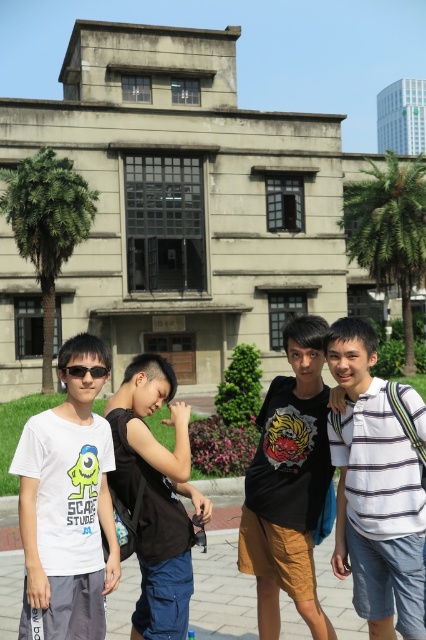
Question: Does gray concrete pavement at lower center appear on the right side of black plastic sunglasses at center?

Choices:
 (A) yes
 (B) no

Answer: (A)

Question: Does white matte t-shirt at left lie in front of gray concrete pavement at lower center?

Choices:
 (A) no
 (B) yes

Answer: (B)

Question: Which object appears closest to the camera in this image?

Choices:
 (A) black matte t-shirt at center
 (B) black cotton tank top at center
 (C) white matte t-shirt at left

Answer: (C)

Question: Does white matte t-shirt at left have a lesser width compared to gray concrete pavement at lower center?

Choices:
 (A) no
 (B) yes

Answer: (B)

Question: Which point appears farthest from the camera in this image?

Choices:
 (A) (100, 368)
 (B) (321, 602)
 (C) (242, 563)
 (D) (141, 570)

Answer: (B)

Question: Which of the following is the closest to the observer?

Choices:
 (A) white matte t-shirt at left
 (B) black matte t-shirt at center

Answer: (A)